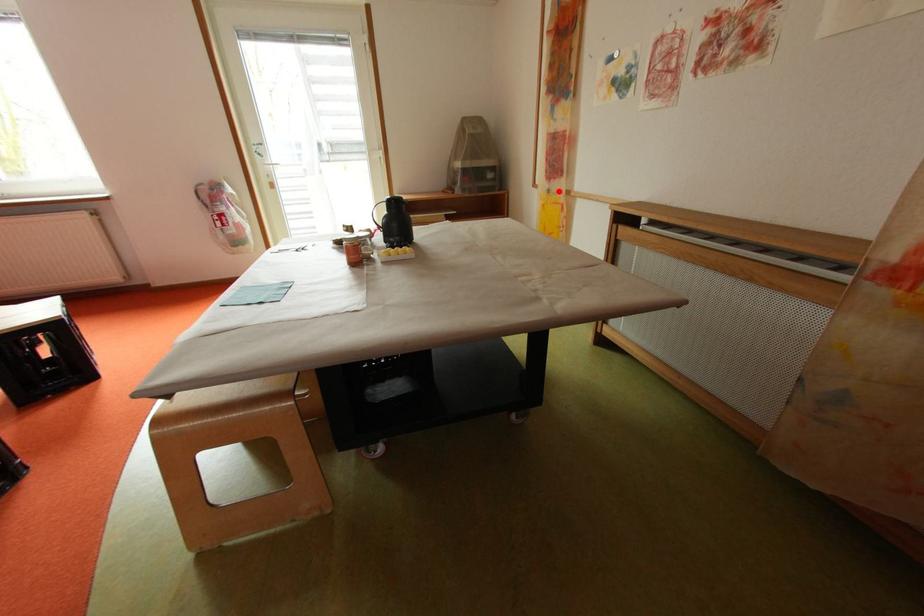
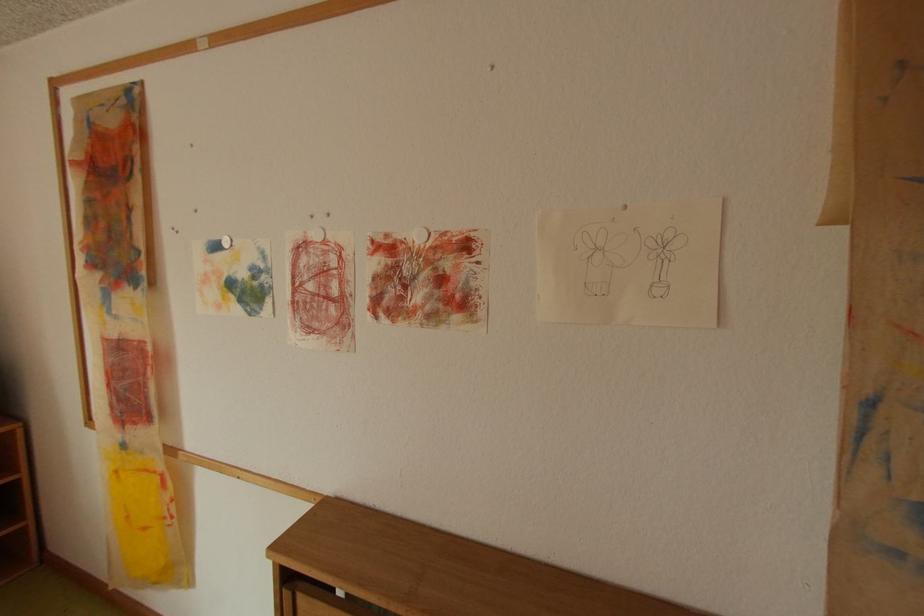
Question: I am providing you with two images of the same scene from different viewpoints. Given a red point in image1, look at the same physical point in image2. Is it:

Choices:
 (A) Closer to the viewpoint
 (B) Farther from the viewpoint

Answer: (B)